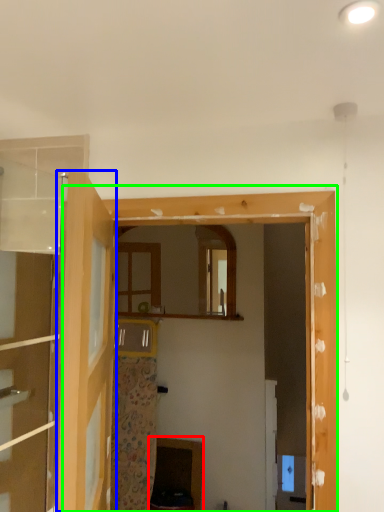
Question: Which is nearer to the cabinetry (highlighted by a red box)? door (highlighted by a blue box) or window frame (highlighted by a green box).

Choices:
 (A) door
 (B) window frame

Answer: (B)